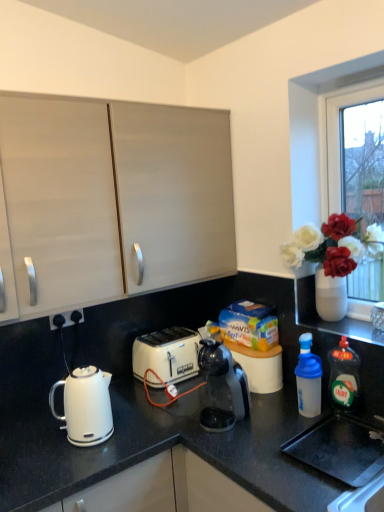
Question: Can you confirm if transparent plastic bottle at right, the second bottle positioned from the right, is wider than matte white cabinet at upper left?

Choices:
 (A) no
 (B) yes

Answer: (A)

Question: Is transparent plastic bottle at right, positioned as the 1th bottle in left-to-right order, oriented away from matte white cabinet at upper left?

Choices:
 (A) no
 (B) yes

Answer: (A)

Question: Could you tell me if transparent plastic bottle at right, the second bottle positioned from the right, is turned towards matte white cabinet at upper left?

Choices:
 (A) yes
 (B) no

Answer: (B)

Question: Is transparent plastic bottle at right, the second bottle positioned from the right, to the right of matte white cabinet at upper left from the viewer's perspective?

Choices:
 (A) yes
 (B) no

Answer: (A)

Question: Does transparent plastic bottle at right, positioned as the 1th bottle in left-to-right order, have a lesser height compared to matte white cabinet at upper left?

Choices:
 (A) yes
 (B) no

Answer: (A)

Question: From a real-world perspective, is transparent plastic bottle at right, positioned as the 1th bottle in left-to-right order, located higher than matte white cabinet at upper left?

Choices:
 (A) yes
 (B) no

Answer: (B)

Question: Considering the relative sizes of green translucent bottle at right, acting as the 1th bottle starting from the right, and transparent plastic bottle at right, positioned as the 1th bottle in left-to-right order, in the image provided, is green translucent bottle at right, acting as the 1th bottle starting from the right, bigger than transparent plastic bottle at right, positioned as the 1th bottle in left-to-right order,?

Choices:
 (A) yes
 (B) no

Answer: (A)

Question: Is the depth of green translucent bottle at right, acting as the 1th bottle starting from the right, greater than that of transparent plastic bottle at right, positioned as the 1th bottle in left-to-right order?

Choices:
 (A) yes
 (B) no

Answer: (B)

Question: Does green translucent bottle at right, acting as the 1th bottle starting from the right, contain transparent plastic bottle at right, positioned as the 1th bottle in left-to-right order?

Choices:
 (A) yes
 (B) no

Answer: (B)

Question: From a real-world perspective, is green translucent bottle at right, acting as the 2th bottle starting from the left, below transparent plastic bottle at right, the second bottle positioned from the right?

Choices:
 (A) yes
 (B) no

Answer: (B)

Question: Does green translucent bottle at right, acting as the 2th bottle starting from the left, have a greater height compared to transparent plastic bottle at right, positioned as the 1th bottle in left-to-right order?

Choices:
 (A) yes
 (B) no

Answer: (A)

Question: Does green translucent bottle at right, acting as the 1th bottle starting from the right, have a smaller size compared to transparent plastic bottle at right, the second bottle positioned from the right?

Choices:
 (A) yes
 (B) no

Answer: (B)

Question: Is white glossy electric kettle at lower left in front of matte white cabinet at upper left?

Choices:
 (A) yes
 (B) no

Answer: (A)